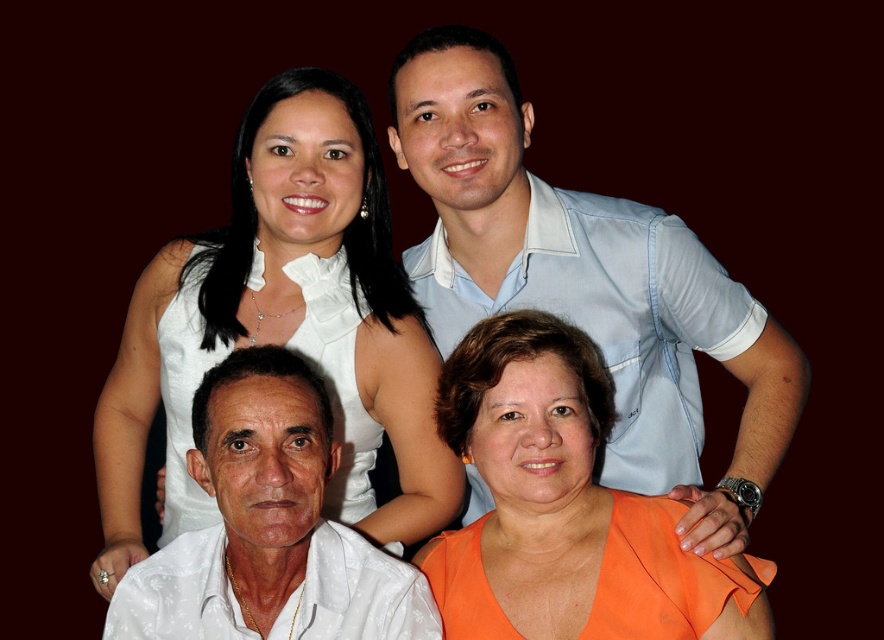
Consider the image. Is white satin dress at upper center to the left of white satin shirt at lower left from the viewer's perspective?

In fact, white satin dress at upper center is to the right of white satin shirt at lower left.

Consider the image. Is the position of white satin dress at upper center more distant than that of white satin shirt at lower left?

That is True.

Find the location of a particular element. The width and height of the screenshot is (884, 640). white satin dress at upper center is located at coordinates (282, 324).

Which is above, white satin dress at upper center or light blue shirt at upper center?

Positioned higher is light blue shirt at upper center.

Is point (367, 369) farther from camera compared to point (664, 448)?

No, it is in front of (664, 448).

Locate an element on the screen. Image resolution: width=884 pixels, height=640 pixels. white satin dress at upper center is located at coordinates (282, 324).

Who is more distant from viewer, (446, 595) or (276, 413)?

The point (446, 595) is more distant.

Can you confirm if orange fabric shirt at lower right is thinner than white satin shirt at lower left?

In fact, orange fabric shirt at lower right might be wider than white satin shirt at lower left.

Does point (512, 426) come behind point (278, 369)?

Yes, point (512, 426) is behind point (278, 369).

Find the location of a particular element. The image size is (884, 640). orange fabric shirt at lower right is located at coordinates (565, 508).